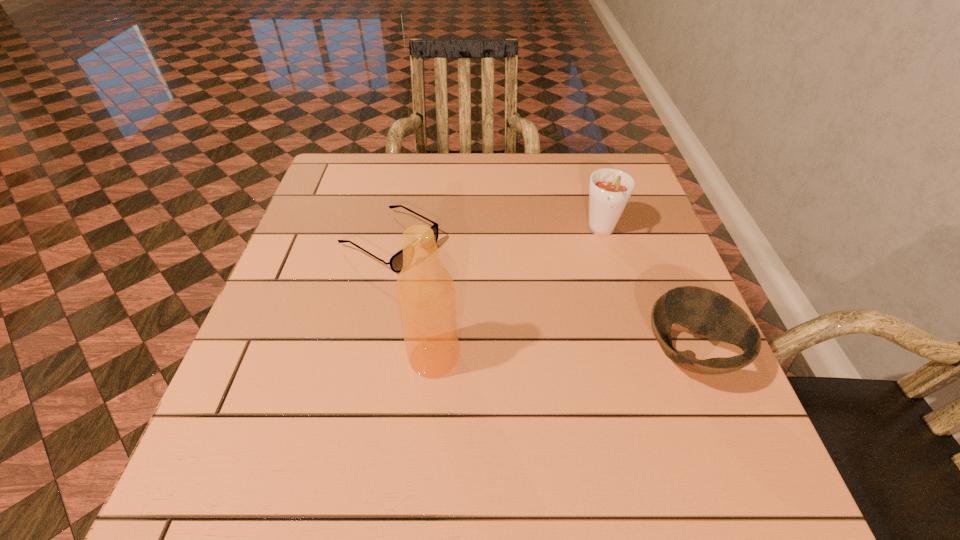
Image resolution: width=960 pixels, height=540 pixels. Identify the location of beer bottle. (425, 293).

Find the location of `the second shortest object`. the second shortest object is located at coordinates (705, 312).

You are a GUI agent. You are given a task and a screenshot of the screen. Output one action in this format:
    pyautogui.click(x=<x>, y=<y>)
    Task: Click on the root beer
    The height and width of the screenshot is (540, 960).
    Given the screenshot: What is the action you would take?
    pyautogui.click(x=610, y=189)

Locate an element on the screen. This screenshot has height=540, width=960. spectacles is located at coordinates (396, 262).

You are a GUI agent. You are given a task and a screenshot of the screen. Output one action in this format:
    pyautogui.click(x=<x>, y=<y>)
    Task: Click on the free space located 0.230m on the left of the tallest object
    
    Given the screenshot: What is the action you would take?
    tap(287, 357)

At what (x,y) coordinates should I click in order to perform the action: click on vacant space located on the back of the third tallest object. Please return your answer as a coordinate pair (x, y). The image size is (960, 540). Looking at the image, I should click on (665, 295).

In order to click on free point located on the drink side of the root beer in this screenshot , I will do `click(568, 297)`.

Find the location of a particular element. free space located 0.360m on the drink side of the root beer is located at coordinates (533, 359).

I want to click on free space located 0.370m on the drink side of the root beer, so click(530, 363).

What are the coordinates of `vacant area situated on the front-facing side of the spectacles` in the screenshot? It's located at (524, 319).